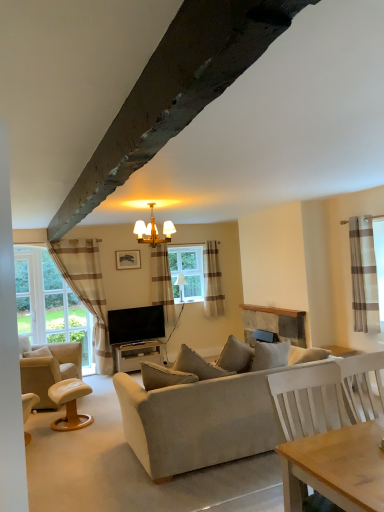
Question: Considering the relative sizes of flat screen tv at center and wooden chandelier at center, positioned as the 1th lamp in front-to-back order, in the image provided, is flat screen tv at center taller than wooden chandelier at center, positioned as the 1th lamp in front-to-back order,?

Choices:
 (A) no
 (B) yes

Answer: (B)

Question: Considering the relative positions of flat screen tv at center and wooden chandelier at center, the 2th lamp when ordered from back to front, in the image provided, is flat screen tv at center in front of wooden chandelier at center, the 2th lamp when ordered from back to front,?

Choices:
 (A) no
 (B) yes

Answer: (A)

Question: Is flat screen tv at center further to camera compared to wooden chandelier at center, the 2th lamp when ordered from back to front?

Choices:
 (A) yes
 (B) no

Answer: (A)

Question: Is flat screen tv at center completely or partially outside of wooden chandelier at center, which is the 1th lamp from top to bottom?

Choices:
 (A) yes
 (B) no

Answer: (A)

Question: Is flat screen tv at center far away from wooden chandelier at center, the 2th lamp when ordered from back to front?

Choices:
 (A) yes
 (B) no

Answer: (A)

Question: Does flat screen tv at center turn towards wooden chandelier at center, the 2th lamp when ordered from back to front?

Choices:
 (A) yes
 (B) no

Answer: (B)

Question: Is wooden picture frame at upper center positioned with its back to matte gray table at center?

Choices:
 (A) yes
 (B) no

Answer: (B)

Question: Is wooden picture frame at upper center positioned far away from matte gray table at center?

Choices:
 (A) no
 (B) yes

Answer: (B)

Question: Is wooden picture frame at upper center facing towards matte gray table at center?

Choices:
 (A) no
 (B) yes

Answer: (A)

Question: Can you confirm if wooden picture frame at upper center is positioned to the left of matte gray table at center?

Choices:
 (A) no
 (B) yes

Answer: (B)

Question: From the image's perspective, is wooden picture frame at upper center located beneath matte gray table at center?

Choices:
 (A) yes
 (B) no

Answer: (B)

Question: From a real-world perspective, is wooden picture frame at upper center below matte gray table at center?

Choices:
 (A) yes
 (B) no

Answer: (B)

Question: Does light brown leather stool at lower left have a greater width compared to beige striped curtain at left?

Choices:
 (A) yes
 (B) no

Answer: (A)